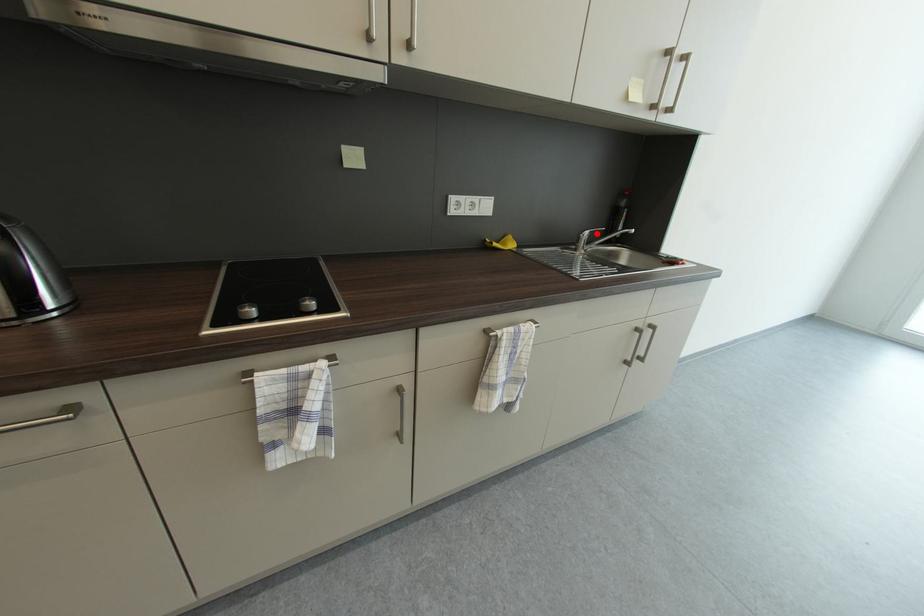
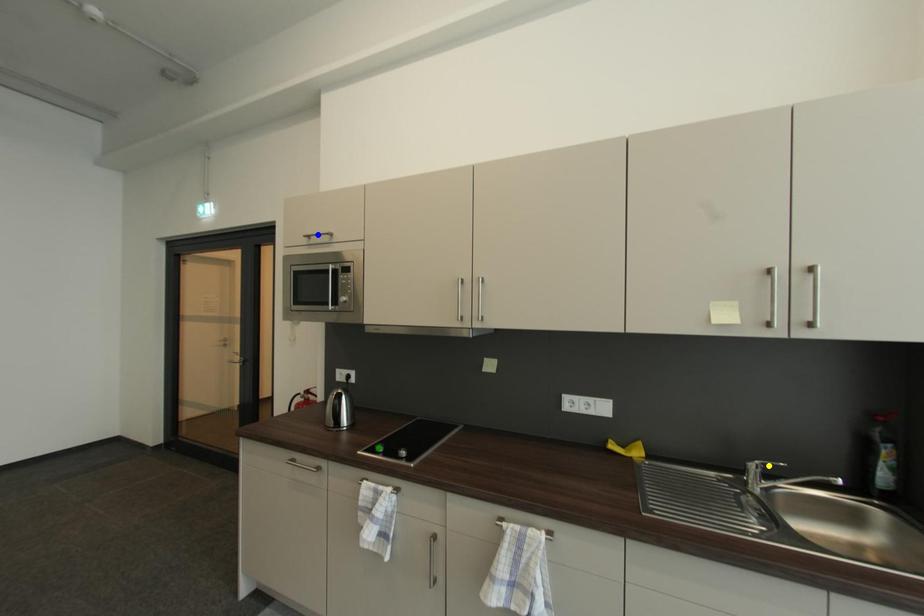
Question: I am providing you with two images of the same scene from different viewpoints. A red point is marked on the first image. You are given multiple points on the second image. Which spot in image 2 lines up with the point in image 1?

Choices:
 (A) yellow point
 (B) blue point
 (C) green point

Answer: (A)